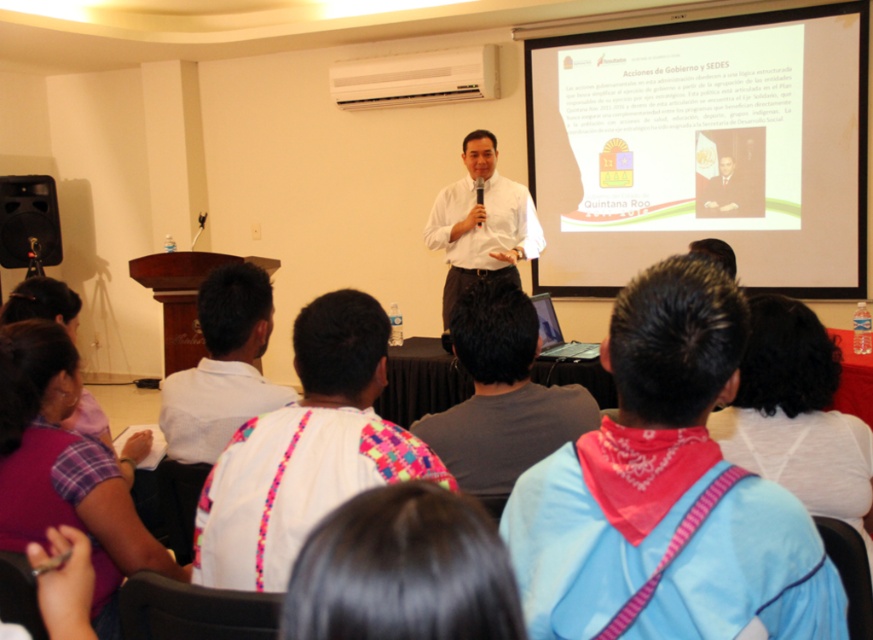
Consider the image. You are attending a presentation and notice two items at the center of the image. Which one is shorter, the pink bandana at center or the white shirt at center?

The pink bandana at center is shorter than the white shirt at center.

You are an observer in the room. You notice the pink bandana at center and the white woven shirt at center. Which one is smaller in size?

The pink bandana at center has a smaller size compared to the white woven shirt at center.

Based on the photo, you are an attendee at the presentation and notice two items at the center of the stage. One is a pink bandana at center and the other is a white shirt at center. Which item is positioned more to the right side?

The pink bandana at center is positioned to the right of the white shirt at center, so the pink bandana at center is more to the right side.